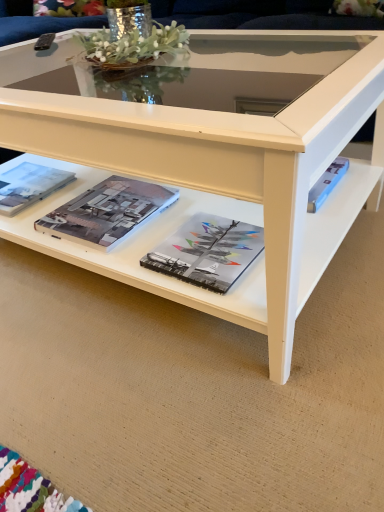
Question: Is matte paper magazine at center, the second magazine from the left, located within matte hardcover book at center, positioned as the 3th magazine in left-to-right order?

Choices:
 (A) yes
 (B) no

Answer: (B)

Question: Is matte hardcover book at center, positioned as the 3th magazine in left-to-right order, thinner than matte paper magazine at center, the second magazine from the left?

Choices:
 (A) no
 (B) yes

Answer: (B)

Question: Is matte hardcover book at center, positioned as the 3th magazine in left-to-right order, next to matte paper magazine at center, placed as the 2th magazine when sorted from right to left, and touching it?

Choices:
 (A) no
 (B) yes

Answer: (A)

Question: Can you confirm if matte hardcover book at center, the first magazine in the right-to-left sequence, is bigger than matte paper magazine at center, placed as the 2th magazine when sorted from right to left?

Choices:
 (A) no
 (B) yes

Answer: (A)

Question: Is matte hardcover book at center, the first magazine in the right-to-left sequence, oriented away from matte paper magazine at center, the second magazine from the left?

Choices:
 (A) no
 (B) yes

Answer: (A)

Question: Is matte paper magazine at left, the first magazine positioned from the left, taller or shorter than matte paper magazine at center, the second magazine from the left?

Choices:
 (A) tall
 (B) short

Answer: (A)

Question: Is point (44, 177) positioned closer to the camera than point (119, 202)?

Choices:
 (A) closer
 (B) farther

Answer: (B)

Question: From a real-world perspective, is matte paper magazine at left, acting as the 3th magazine starting from the right, physically located above or below matte paper magazine at center, the second magazine from the left?

Choices:
 (A) above
 (B) below

Answer: (B)

Question: Is matte paper magazine at left, the first magazine positioned from the left, bigger or smaller than matte paper magazine at center, the second magazine from the left?

Choices:
 (A) big
 (B) small

Answer: (B)

Question: Is matte hardcover book at center, the first magazine in the right-to-left sequence, wider or thinner than matte paper magazine at center, the second magazine from the left?

Choices:
 (A) thin
 (B) wide

Answer: (A)

Question: Is point (244, 251) positioned closer to the camera than point (119, 196)?

Choices:
 (A) closer
 (B) farther

Answer: (A)

Question: Based on their positions, is matte hardcover book at center, the first magazine in the right-to-left sequence, located to the left or right of matte paper magazine at center, the second magazine from the left?

Choices:
 (A) right
 (B) left

Answer: (A)

Question: From a real-world perspective, relative to matte paper magazine at center, the second magazine from the left, is matte hardcover book at center, the first magazine in the right-to-left sequence, vertically above or below?

Choices:
 (A) above
 (B) below

Answer: (B)

Question: Is matte hardcover book at center, positioned as the 3th magazine in left-to-right order, to the left or to the right of white glossy coffee table at center in the image?

Choices:
 (A) left
 (B) right

Answer: (B)

Question: Considering the positions of point (230, 286) and point (160, 161), is point (230, 286) closer or farther from the camera than point (160, 161)?

Choices:
 (A) farther
 (B) closer

Answer: (A)